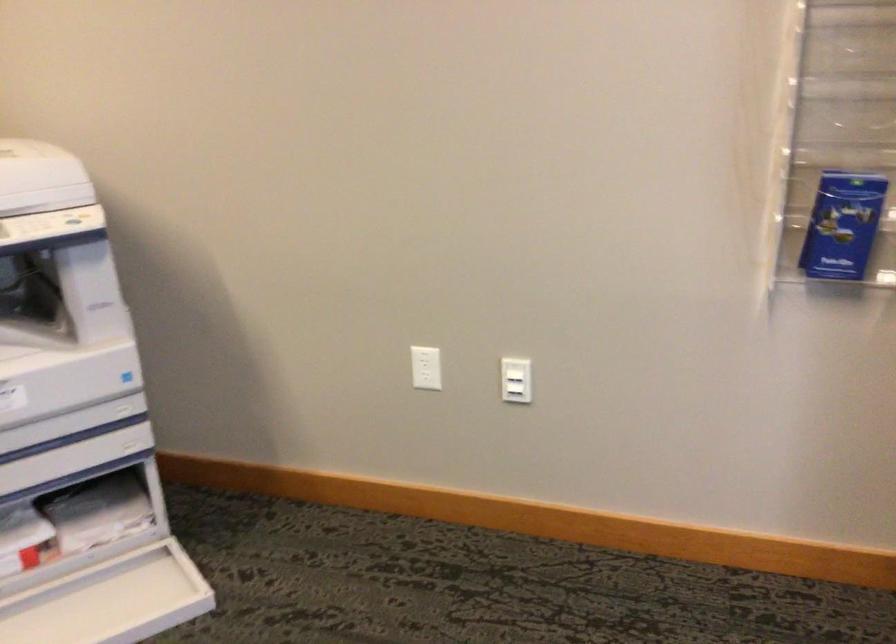
Describe the element at coordinates (426, 368) in the screenshot. I see `the white electrical outlet` at that location.